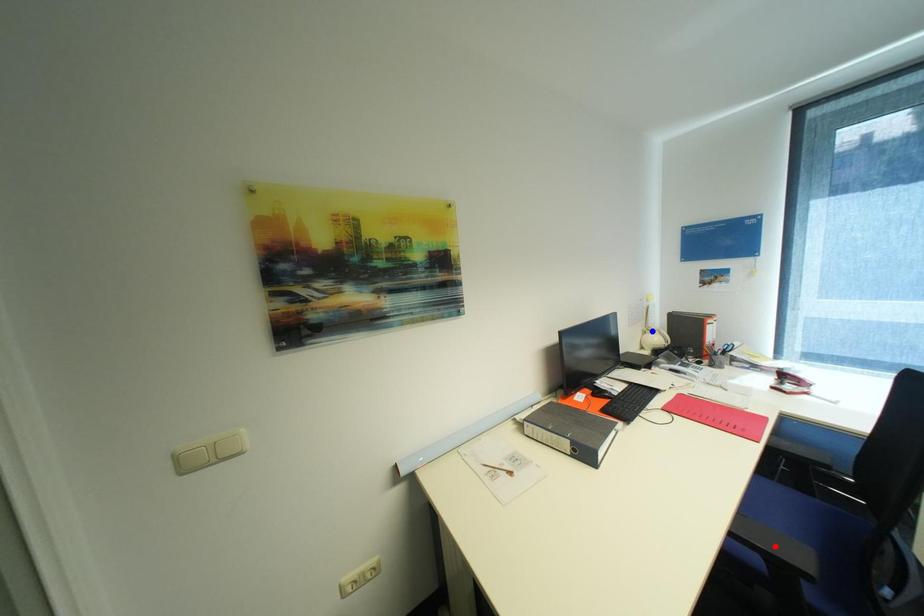
Question: In the image, two points are highlighted. Which point is nearer to the camera? Reply with the corresponding letter.

Choices:
 (A) blue point
 (B) red point

Answer: (B)